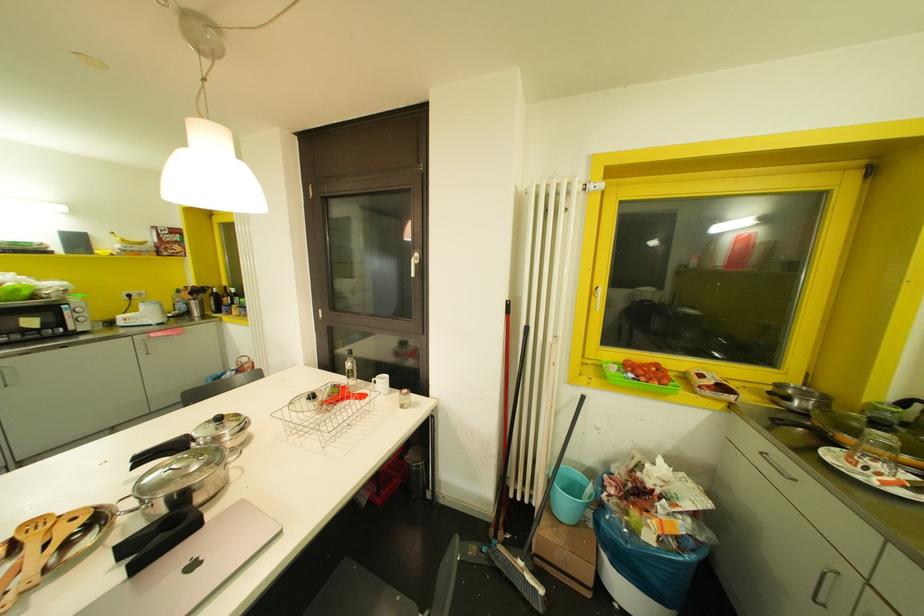
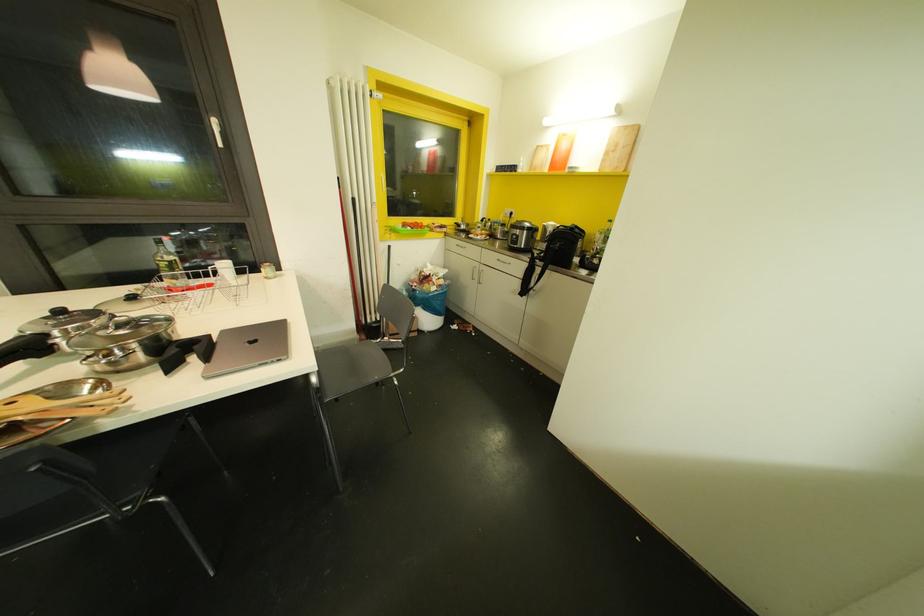
Locate, in the second image, the point that corresponds to the point at 582,397 in the first image.

(388, 246)